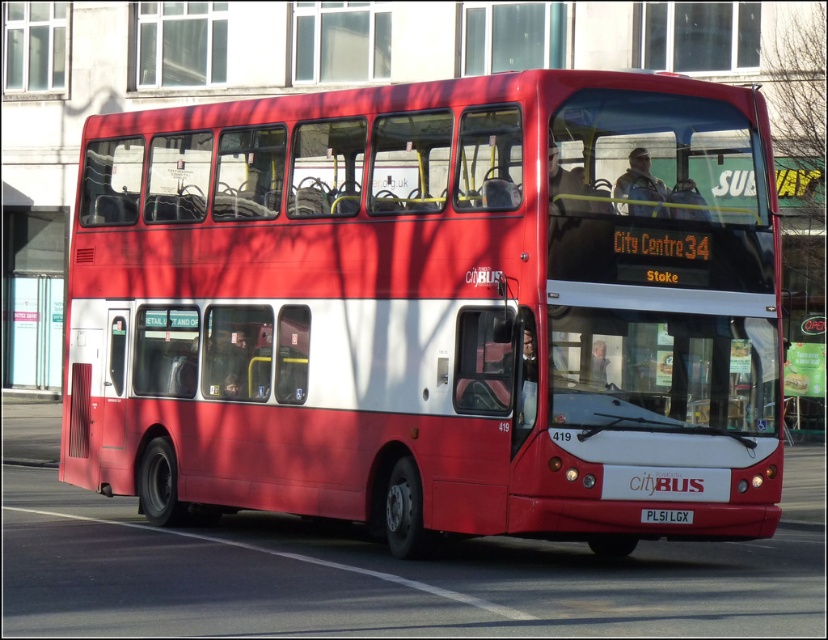
Is matte red bus at center in front of black plastic license plate at bottom center?

Yes, it is in front of black plastic license plate at bottom center.

Between matte red bus at center and black plastic license plate at bottom center, which one is positioned lower?

black plastic license plate at bottom center is lower down.

The width and height of the screenshot is (828, 640). I want to click on matte red bus at center, so click(x=436, y=308).